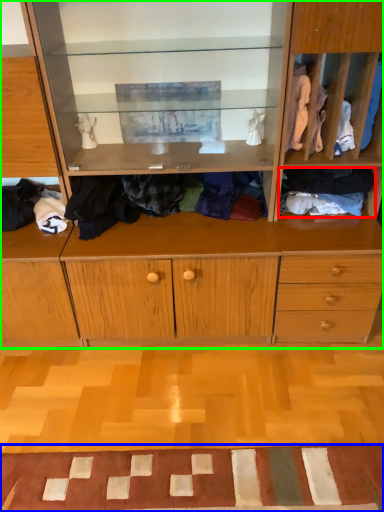
Question: Which object is positioned farthest from clothing (highlighted by a red box)? Select from doormat (highlighted by a blue box) and cabinetry (highlighted by a green box).

Choices:
 (A) doormat
 (B) cabinetry

Answer: (A)